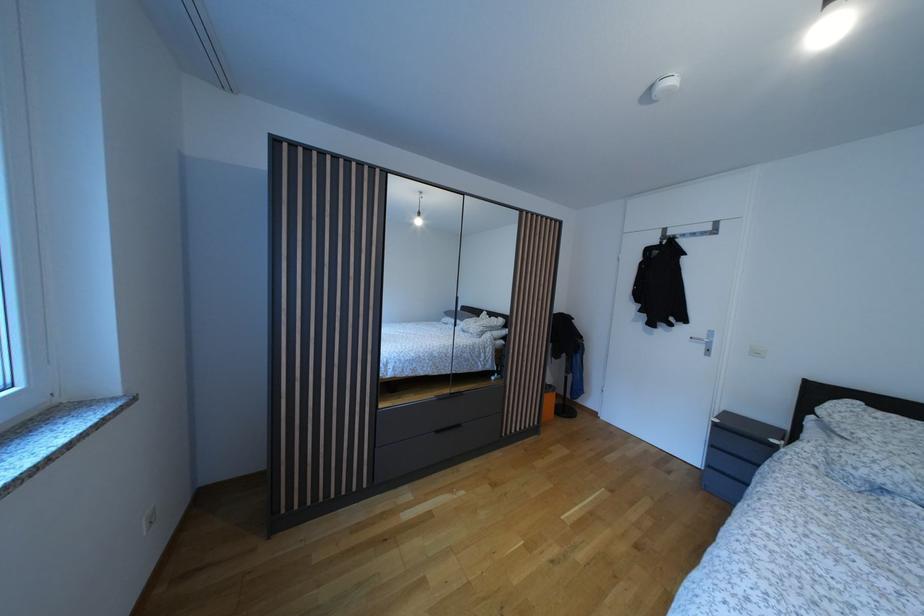
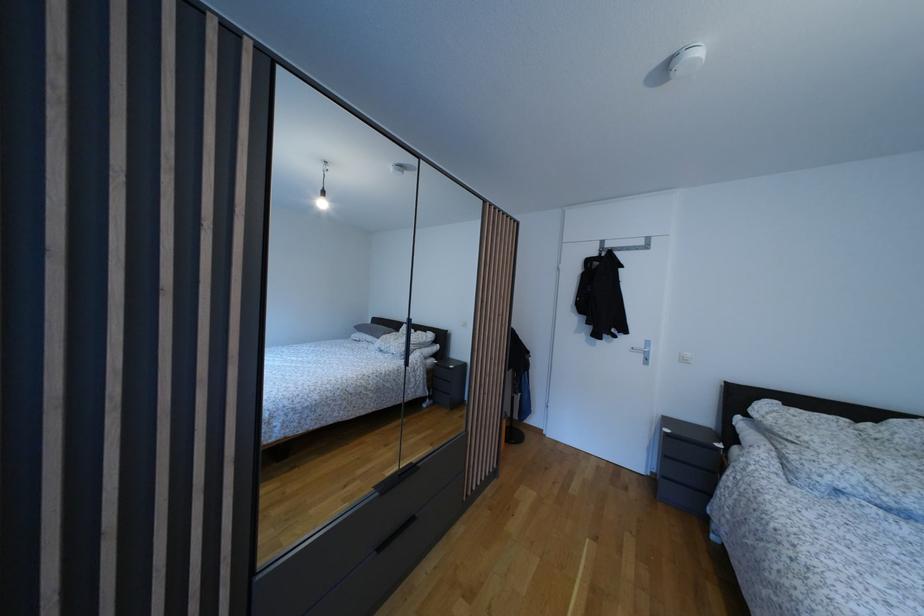
Question: The images are taken continuously from a first-person perspective. In which direction is your viewpoint rotating?

Choices:
 (A) Left
 (B) Right
 (C) Up
 (D) Down

Answer: (B)